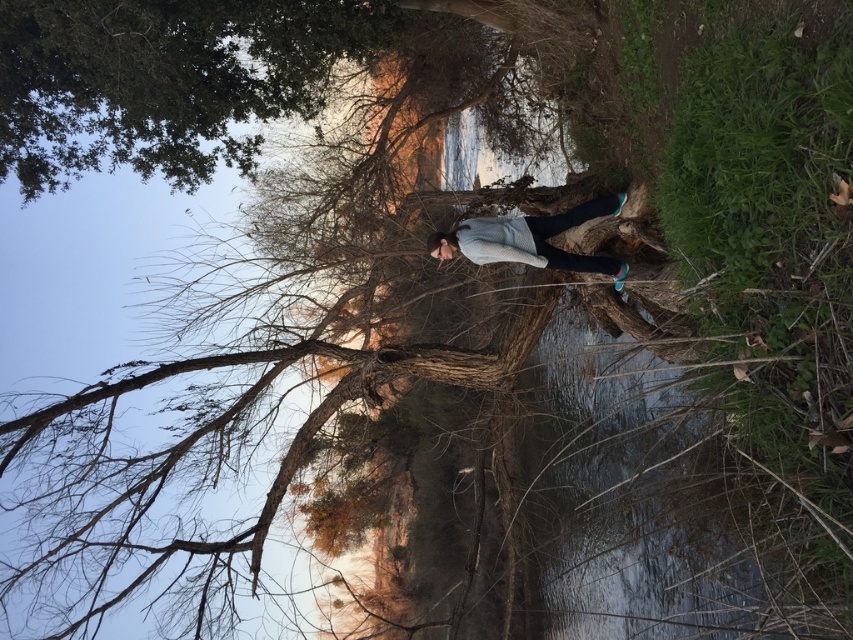
You are a hiker who wants to take a photo of the green leafy tree at upper left while standing on the tree stump. Based on the scene description, where should you position yourself relative to the tree stump to ensure the tree is fully in the frame?

The green leafy tree at upper left is located at point (164,80), so to capture it fully in your photo while standing on the stump, position yourself facing the upper left direction where the tree is situated.

You are a hiker who wants to take a photo of the green leafy tree at upper left and the white sweater at center. Which object should you adjust your camera angle to look up at, and which to look down at?

To capture both the green leafy tree at upper left and the white sweater at center, you should adjust your camera angle to look up at the green leafy tree at upper left, which is above, and look down at the white sweater at center, which is below.